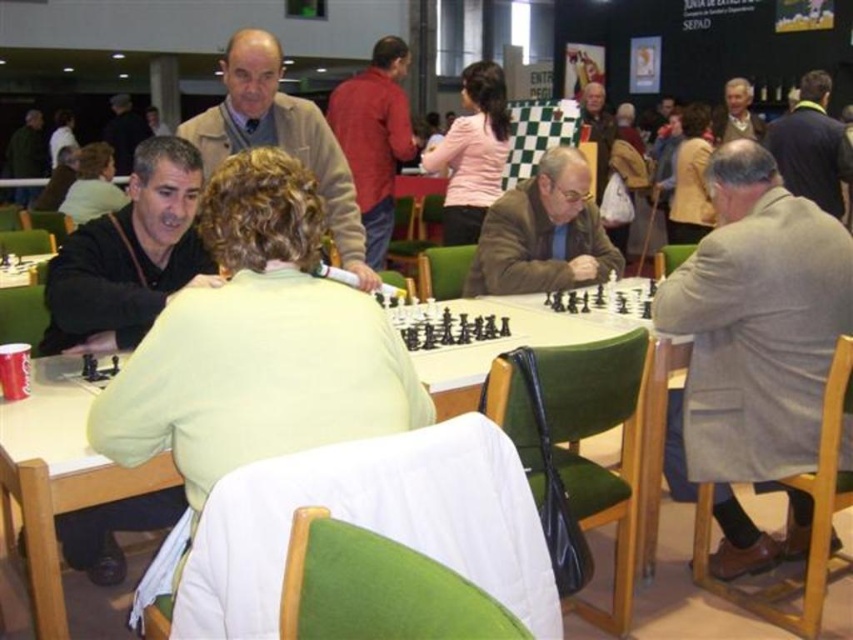
Question: Is red fabric shirt at center below dark blue fabric jacket at upper right?

Choices:
 (A) yes
 (B) no

Answer: (A)

Question: Is matte brown jacket at center to the left of dark gray suit at upper left from the viewer's perspective?

Choices:
 (A) yes
 (B) no

Answer: (B)

Question: Which of the following is the farthest from the observer?

Choices:
 (A) dark green jacket at upper left
 (B) black matte jacket at left
 (C) matte brown jacket at center
 (D) gray woolen coat at right

Answer: (A)

Question: Can you confirm if gray woolen coat at right is positioned to the left of black matte jacket at left?

Choices:
 (A) yes
 (B) no

Answer: (B)

Question: Among these objects, which one is farthest from the camera?

Choices:
 (A) white glossy table at center
 (B) matte brown jacket at center

Answer: (B)

Question: Estimate the real-world distances between objects in this image. Which object is closer to the red fabric shirt at center?

Choices:
 (A) gray woolen coat at right
 (B) dark gray suit at upper left
 (C) white glossy table at center
 (D) matte brown jacket at center

Answer: (D)